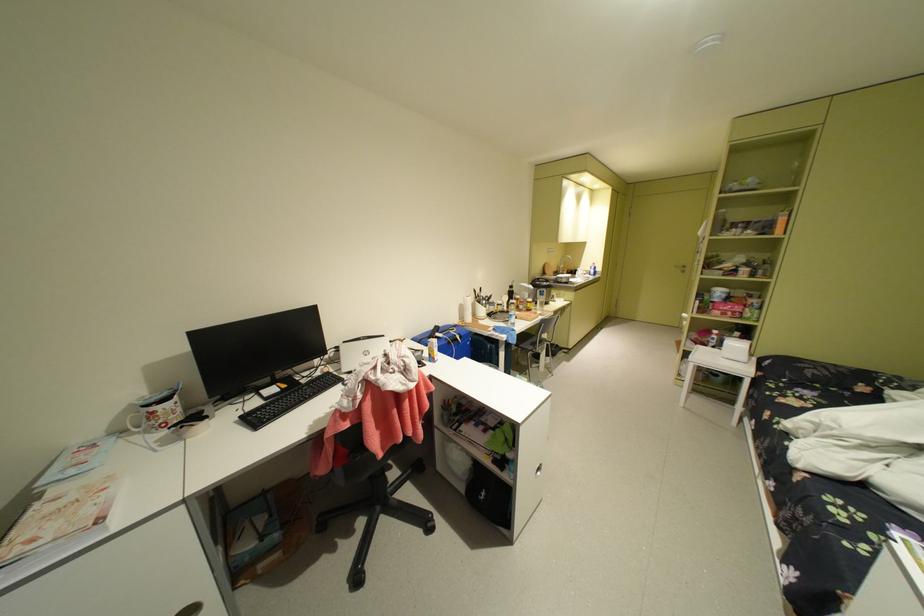
Locate an element on the screen. patterned white mug is located at coordinates (136, 423).